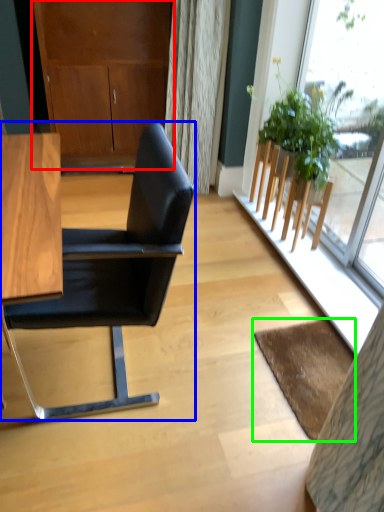
Question: Estimate the real-world distances between objects in this image. Which object is farther from dresser (highlighted by a red box), chair (highlighted by a blue box) or mat (highlighted by a green box)?

Choices:
 (A) chair
 (B) mat

Answer: (B)